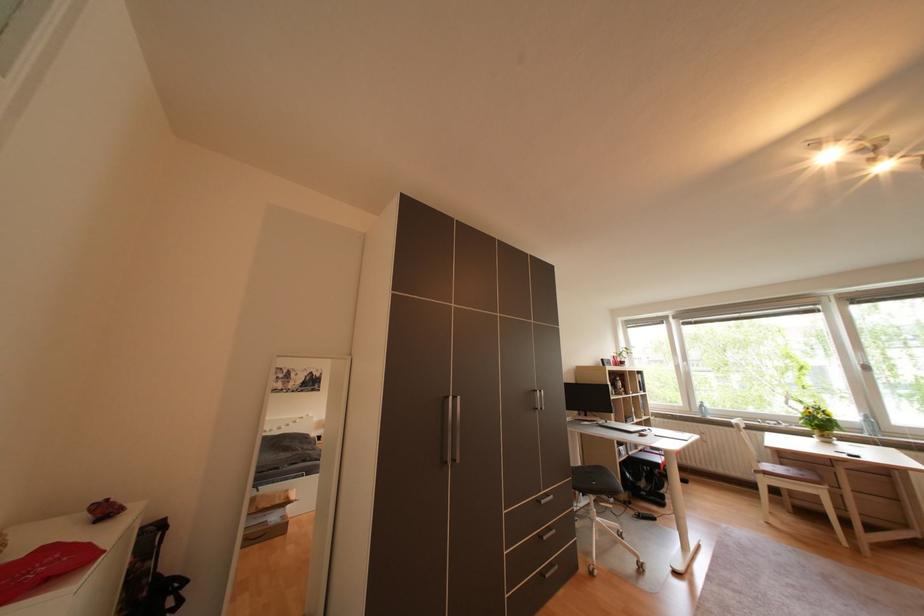
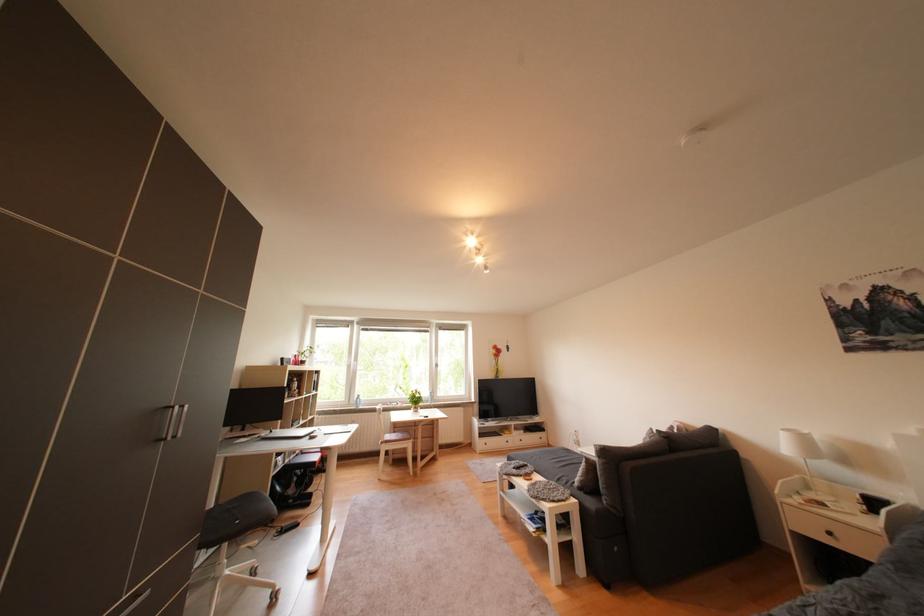
Question: Based on the continuous images, in which direction is the camera rotating? Reply with the corresponding letter.

Choices:
 (A) Left
 (B) Right
 (C) Up
 (D) Down

Answer: (B)